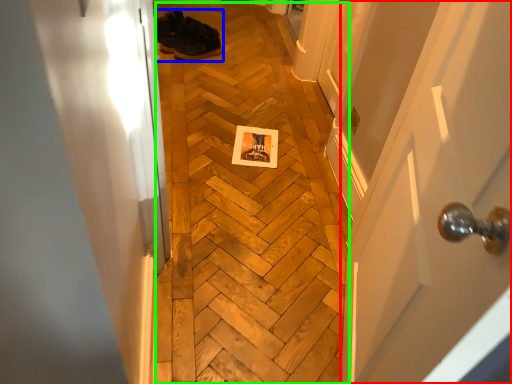
Question: Estimate the real-world distances between objects in this image. Which object is farther from door (highlighted by a red box), footwear (highlighted by a blue box) or plywood (highlighted by a green box)?

Choices:
 (A) footwear
 (B) plywood

Answer: (A)